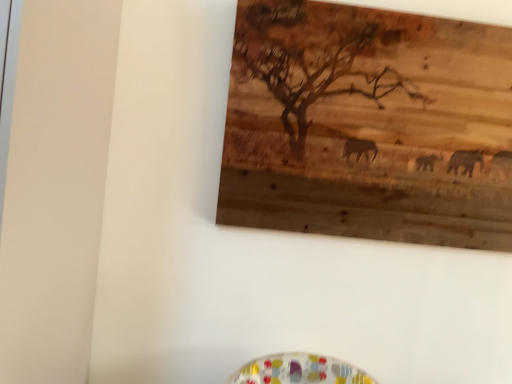
The width and height of the screenshot is (512, 384). What do you see at coordinates (369, 125) in the screenshot? I see `wooden painting at upper center` at bounding box center [369, 125].

The width and height of the screenshot is (512, 384). I want to click on wooden painting at upper center, so click(369, 125).

Image resolution: width=512 pixels, height=384 pixels. Find the location of `wooden painting at upper center`. wooden painting at upper center is located at coordinates (369, 125).